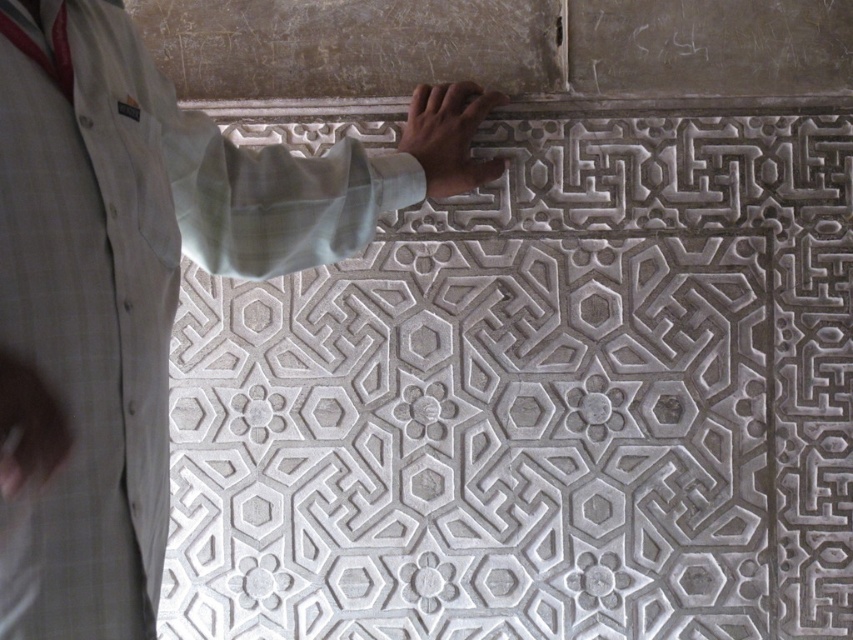
Can you confirm if carved stone pattern at center is bigger than white fabric shirt at upper left?

Incorrect, carved stone pattern at center is not larger than white fabric shirt at upper left.

Identify the location of carved stone pattern at center. (537, 403).

Locate an element on the screen. This screenshot has width=853, height=640. carved stone pattern at center is located at coordinates (537, 403).

Describe the element at coordinates (537, 403) in the screenshot. The height and width of the screenshot is (640, 853). I see `carved stone pattern at center` at that location.

Does carved stone pattern at center have a lesser width compared to matte gray hand at upper center?

Incorrect, carved stone pattern at center's width is not less than matte gray hand at upper center's.

Locate an element on the screen. carved stone pattern at center is located at coordinates (537, 403).

Who is positioned more to the left, light skin hand at center or matte gray hand at upper center?

Positioned to the left is matte gray hand at upper center.

What do you see at coordinates (450, 134) in the screenshot? The image size is (853, 640). I see `light skin hand at center` at bounding box center [450, 134].

Where is `light skin hand at center`? This screenshot has height=640, width=853. light skin hand at center is located at coordinates (450, 134).